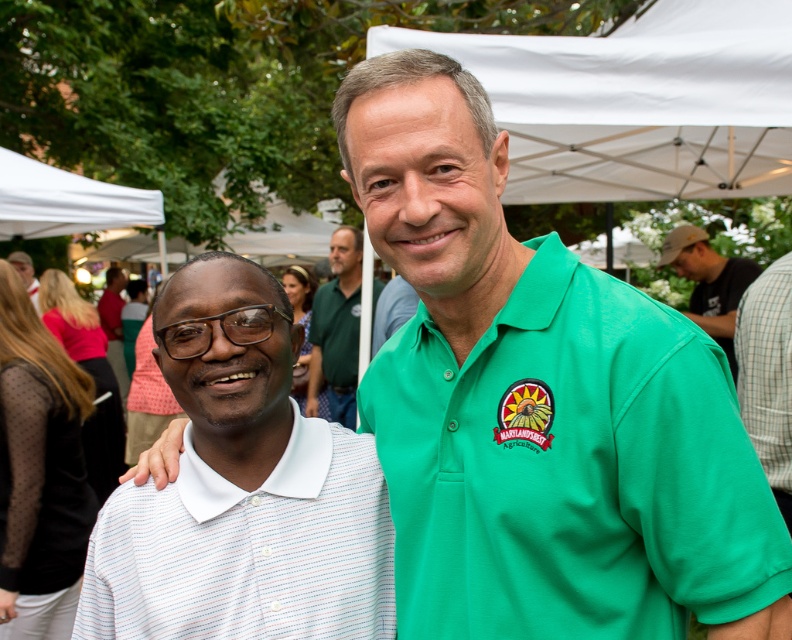
Can you confirm if white striped polo shirt at left is taller than matte black glasses at upper left?

No.

Does white striped polo shirt at left appear on the right side of matte black glasses at upper left?

Indeed, white striped polo shirt at left is positioned on the right side of matte black glasses at upper left.

Is point (370, 506) farther from viewer compared to point (21, 268)?

No, (370, 506) is closer to viewer.

Where is `white striped polo shirt at left`? The width and height of the screenshot is (792, 640). white striped polo shirt at left is located at coordinates (248, 548).

Does white fabric canopy at upper left lie behind matte black glasses at upper left?

That is False.

Can you confirm if white fabric canopy at upper left is bigger than matte black glasses at upper left?

Correct, white fabric canopy at upper left is larger in size than matte black glasses at upper left.

Which is in front, point (112, 220) or point (29, 296)?

Positioned in front is point (112, 220).

This screenshot has width=792, height=640. What are the coordinates of `white fabric canopy at upper left` in the screenshot? It's located at click(67, 200).

What do you see at coordinates (570, 468) in the screenshot? I see `green woven polo shirt at center` at bounding box center [570, 468].

Between green woven polo shirt at center and green cotton polo shirt at center, which one has less height?

Standing shorter between the two is green woven polo shirt at center.

Who is more forward, (398, 628) or (341, 250)?

Point (398, 628)

Locate an element on the screen. The height and width of the screenshot is (640, 792). green woven polo shirt at center is located at coordinates (570, 468).